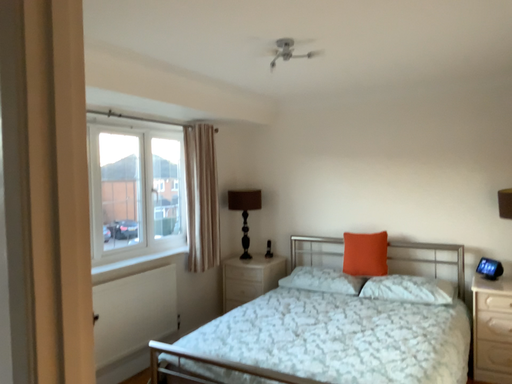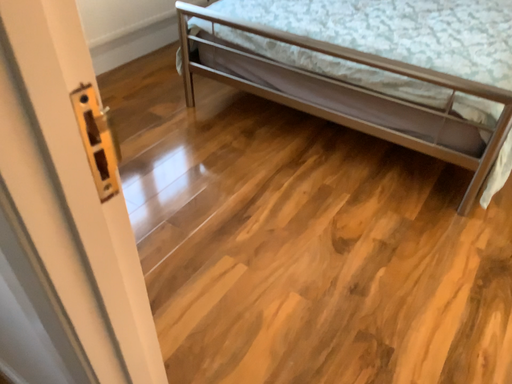
Question: How did the camera likely rotate when shooting the video?

Choices:
 (A) rotated downward
 (B) rotated upward

Answer: (A)